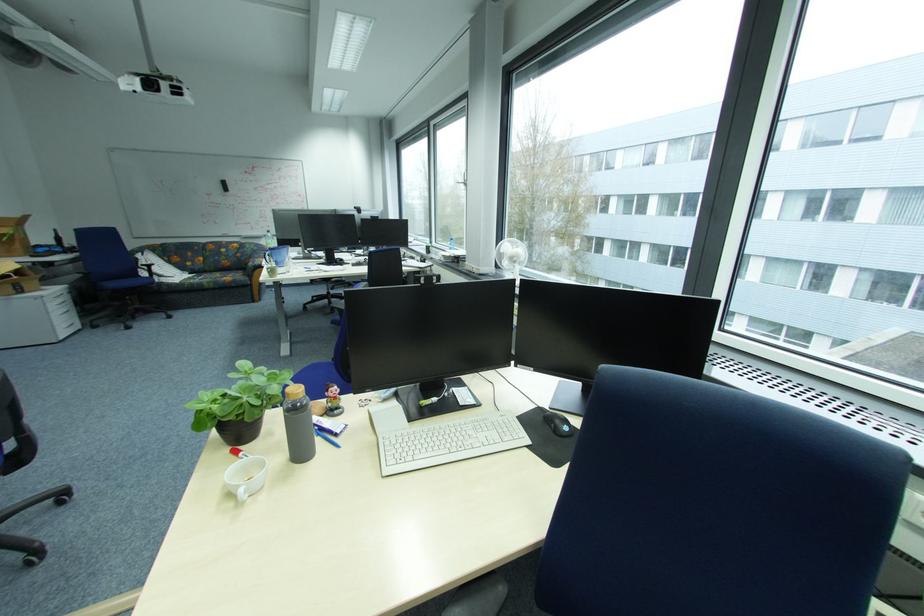
I want to click on window handle, so click(x=462, y=184).